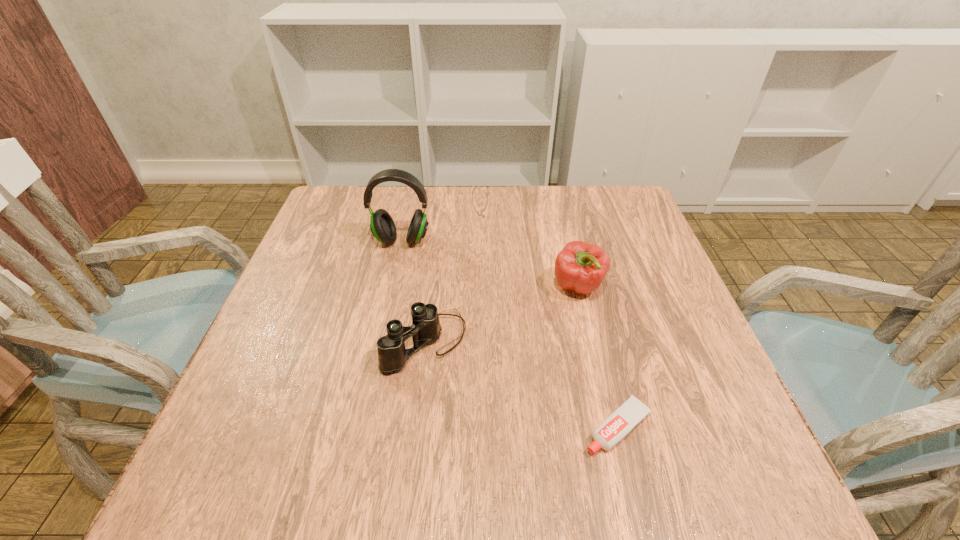
You are a GUI agent. You are given a task and a screenshot of the screen. Output one action in this format:
    pyautogui.click(x=<x>, y=<y>)
    Task: Click on the vacant space located 0.230m on the right of the second nearest object
    
    Given the screenshot: What is the action you would take?
    pyautogui.click(x=581, y=342)

Where is `vacant space situated 0.280m on the back of the nearest object`? The image size is (960, 540). vacant space situated 0.280m on the back of the nearest object is located at coordinates (584, 291).

Locate an element on the screen. The width and height of the screenshot is (960, 540). object that is at the far edge is located at coordinates (382, 226).

I want to click on object that is at the near edge, so click(x=630, y=413).

I want to click on bell pepper situated at the right edge, so click(x=580, y=267).

Identify the location of toothpaste that is at the right edge. The height and width of the screenshot is (540, 960). (630, 413).

Locate an element on the screen. object present at the near right corner is located at coordinates (630, 413).

Identify the location of free spot at the far edge of the desktop. Image resolution: width=960 pixels, height=540 pixels. (557, 207).

Identify the location of vacant region at the near edge of the desktop. The width and height of the screenshot is (960, 540). (367, 470).

In the image, there is a desktop. Identify the location of free space at the left edge. The image size is (960, 540). (285, 354).